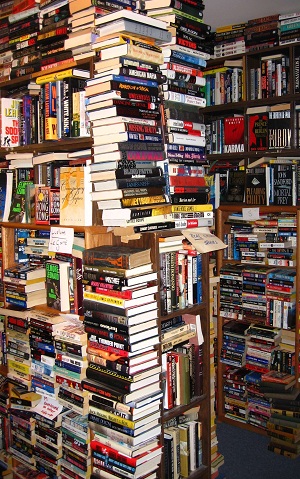
Identify the location of sticky note. The image size is (300, 479). (51, 413), (204, 239), (52, 240), (250, 210).